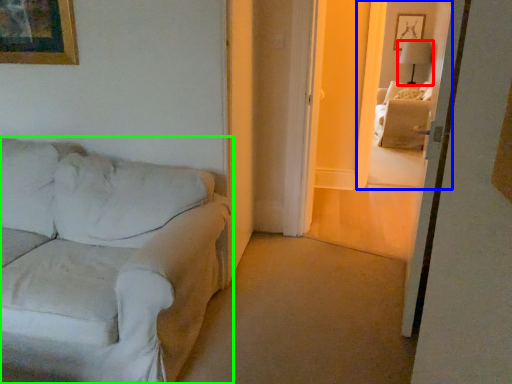
Question: Based on their relative distances, which object is nearer to lamp (highlighted by a red box)? Choose from window (highlighted by a blue box) and studio couch (highlighted by a green box).

Choices:
 (A) window
 (B) studio couch

Answer: (A)